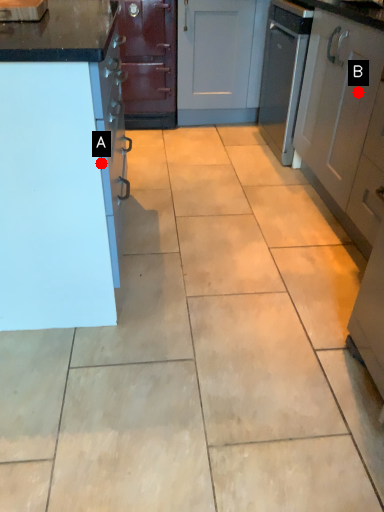
Question: Two points are circled on the image, labeled by A and B beside each circle. Which point appears farthest from the camera in this image?

Choices:
 (A) A is further
 (B) B is further

Answer: (B)